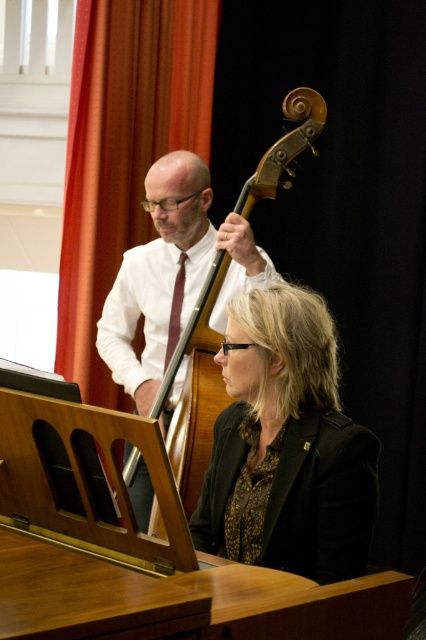
Looking at this image, who is taller, wooden cello at center or maroon satin tie at center?

wooden cello at center

Is wooden cello at center further to camera compared to maroon satin tie at center?

No.

Is point (178, 474) farther from viewer compared to point (178, 273)?

That is False.

Image resolution: width=426 pixels, height=640 pixels. I want to click on wooden cello at center, so click(x=195, y=390).

Can you confirm if black textured blazer at center is smaller than maroon satin tie at center?

Incorrect, black textured blazer at center is not smaller in size than maroon satin tie at center.

Can you confirm if black textured blazer at center is positioned to the left of maroon satin tie at center?

Incorrect, black textured blazer at center is not on the left side of maroon satin tie at center.

Locate an element on the screen. black textured blazer at center is located at coordinates (287, 445).

Who is positioned more to the right, black textured blazer at center or wooden cello at center?

From the viewer's perspective, black textured blazer at center appears more on the right side.

Which is in front, point (339, 579) or point (215, 296)?

Point (339, 579) is more forward.

Is point (222, 484) closer to viewer compared to point (285, 116)?

Yes.

Find the location of `black textured blazer at center`. black textured blazer at center is located at coordinates (287, 445).